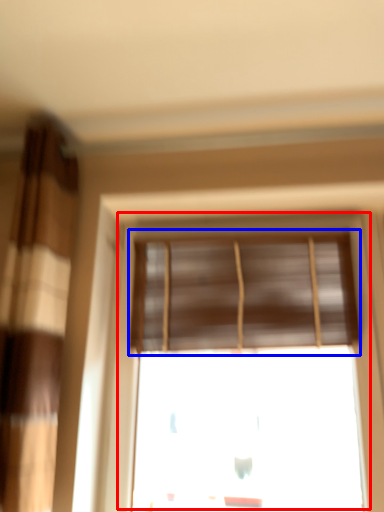
Question: Which point is closer to the camera, window (highlighted by a red box) or window blind (highlighted by a blue box)?

Choices:
 (A) window
 (B) window blind

Answer: (A)